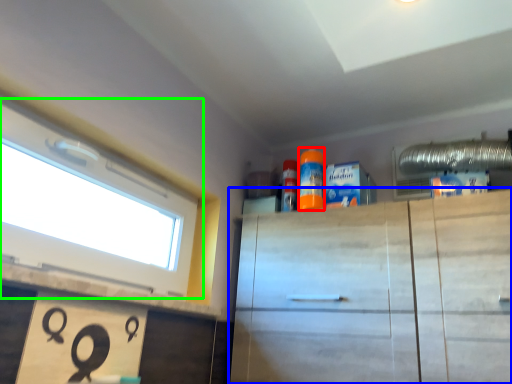
Question: Which object is the farthest from cleaning product (highlighted by a red box)? Choose among these: cabinetry (highlighted by a blue box) or window (highlighted by a green box).

Choices:
 (A) cabinetry
 (B) window

Answer: (B)